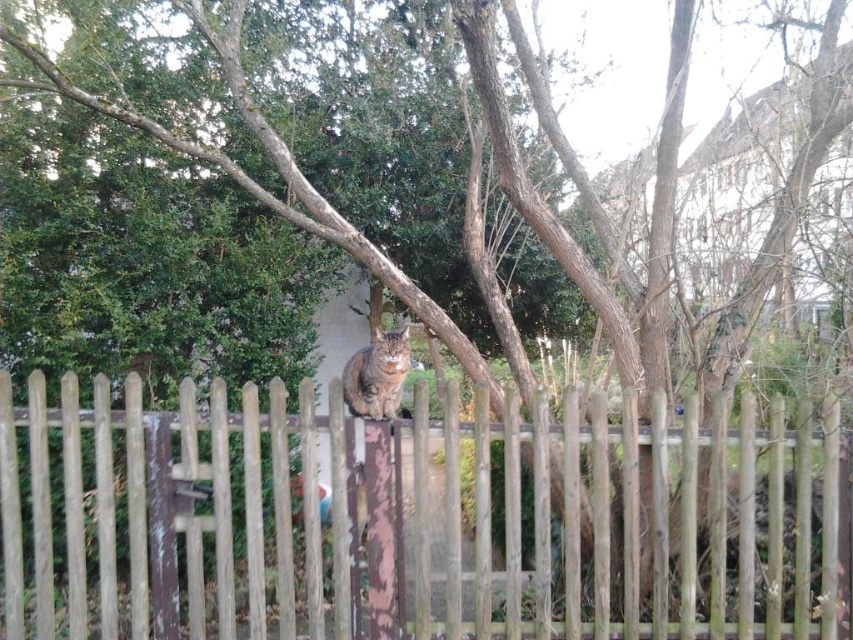
In the scene shown: You are a photographer trying to capture the tabby fur cat at center sitting on the weathered wood fence at center. Based on their positions, can you tell if the cat is sitting on top of the fence or just near it?

The weathered wood fence at center is below the tabby fur cat at center, so the cat is sitting on top of the fence.

You are a photographer trying to capture a closeup of the tabby fur cat at center. The weathered wood fence at center is blocking your view. Can you estimate if the fence is wider than the cat?

The weathered wood fence at center might be wider than tabby fur cat at center, so there is a possibility that the fence is blocking the view of the cat.